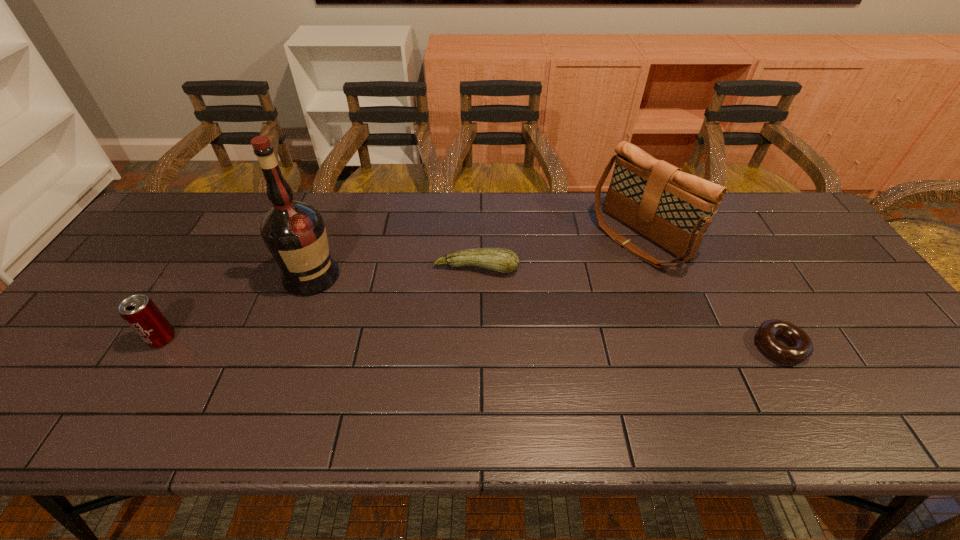
The width and height of the screenshot is (960, 540). Find the location of `vacant space located 0.310m on the front-facing side of the fourth shortest object`. vacant space located 0.310m on the front-facing side of the fourth shortest object is located at coordinates (533, 314).

Identify the location of object present at the far edge. The image size is (960, 540). (672, 208).

The width and height of the screenshot is (960, 540). I want to click on object that is at the near edge, so click(x=801, y=348).

In the image, there is a desktop. Where is `vacant space at the far edge`? The height and width of the screenshot is (540, 960). vacant space at the far edge is located at coordinates (738, 224).

Where is `vacant space at the near edge`? vacant space at the near edge is located at coordinates coord(523,394).

The height and width of the screenshot is (540, 960). In the image, there is a desktop. Identify the location of vacant space at the left edge. (133, 265).

Locate an element on the screen. This screenshot has width=960, height=540. vacant area at the right edge is located at coordinates (847, 310).

Where is `free area in between the second shortest object and the leftmost object`? Image resolution: width=960 pixels, height=540 pixels. free area in between the second shortest object and the leftmost object is located at coordinates (320, 303).

Where is `free space between the fourth object from left to right and the second shortest object`? free space between the fourth object from left to right and the second shortest object is located at coordinates (559, 253).

The height and width of the screenshot is (540, 960). I want to click on vacant area that lies between the shoulder bag and the third object from right to left, so click(x=559, y=253).